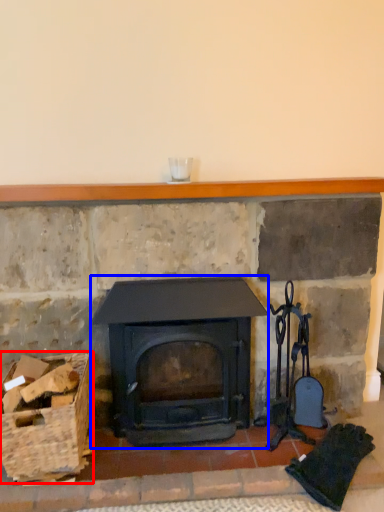
Question: Among these objects, which one is nearest to the camera, basket (highlighted by a red box) or wood burning stove (highlighted by a blue box)?

Choices:
 (A) basket
 (B) wood burning stove

Answer: (A)